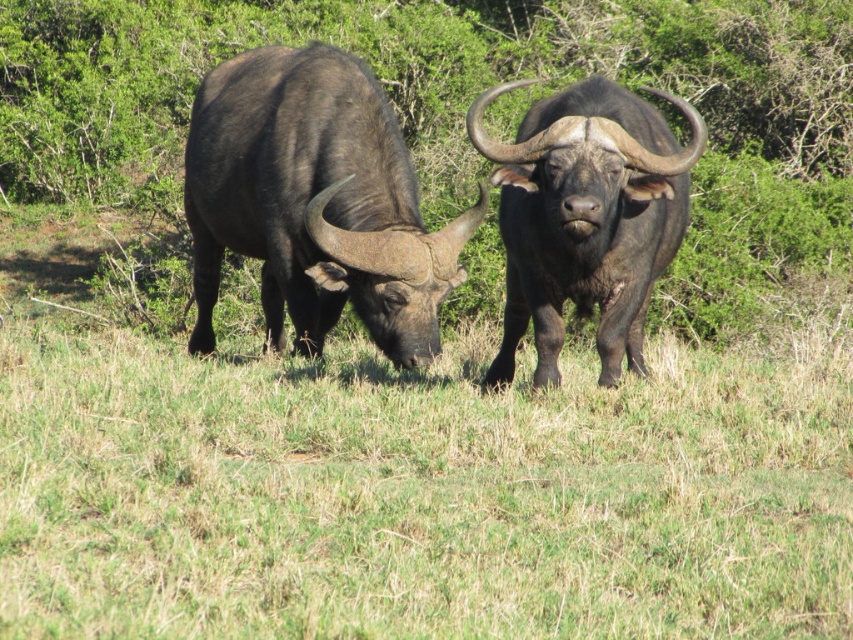
Does green grass at lower center have a lesser width compared to shiny black bull at left?

No.

Does point (299, 620) come in front of point (369, 301)?

Yes, point (299, 620) is closer to viewer.

Is point (666, 371) positioned in front of point (201, 241)?

That is True.

Find the location of `green grass at lower center`. green grass at lower center is located at coordinates (416, 493).

What do you see at coordinates (416, 493) in the screenshot? The height and width of the screenshot is (640, 853). I see `green grass at lower center` at bounding box center [416, 493].

How much distance is there between green grass at lower center and shiny dark brown bull at center?

green grass at lower center and shiny dark brown bull at center are 3.39 feet apart from each other.

Is point (537, 577) in front of point (508, 83)?

Yes.

The width and height of the screenshot is (853, 640). Identify the location of green grass at lower center. (416, 493).

Does shiny black bull at left appear under shiny dark brown bull at center?

Incorrect, shiny black bull at left is not positioned below shiny dark brown bull at center.

Does shiny black bull at left have a lesser height compared to shiny dark brown bull at center?

Incorrect, shiny black bull at left's height does not fall short of shiny dark brown bull at center's.

Locate an element on the screen. shiny black bull at left is located at coordinates (315, 202).

At what (x,y) coordinates should I click in order to perform the action: click on shiny black bull at left. Please return your answer as a coordinate pair (x, y). Image resolution: width=853 pixels, height=640 pixels. Looking at the image, I should click on (315, 202).